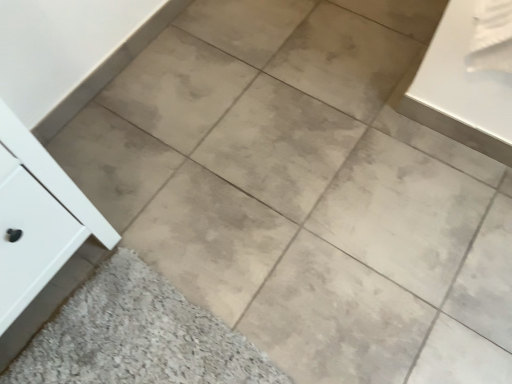
Question: Is white matte cabinet at left taller than beige matte tile at lower left?

Choices:
 (A) no
 (B) yes

Answer: (B)

Question: Is white matte cabinet at left facing towards beige matte tile at lower left?

Choices:
 (A) no
 (B) yes

Answer: (B)

Question: From a real-world perspective, is white matte cabinet at left on top of beige matte tile at lower left?

Choices:
 (A) no
 (B) yes

Answer: (B)

Question: Could beige matte tile at lower left be considered to be inside white matte cabinet at left?

Choices:
 (A) no
 (B) yes

Answer: (A)

Question: Does white matte cabinet at left appear on the right side of beige matte tile at lower left?

Choices:
 (A) yes
 (B) no

Answer: (B)

Question: Does white matte cabinet at left appear on the left side of beige matte tile at lower left?

Choices:
 (A) no
 (B) yes

Answer: (B)

Question: Is beige matte tile at lower left at the right side of white matte cabinet at left?

Choices:
 (A) yes
 (B) no

Answer: (A)

Question: Is beige matte tile at lower left to the left of white matte cabinet at left from the viewer's perspective?

Choices:
 (A) yes
 (B) no

Answer: (B)

Question: Are beige matte tile at lower left and white matte cabinet at left located far from each other?

Choices:
 (A) yes
 (B) no

Answer: (B)

Question: Is beige matte tile at lower left closer to the viewer compared to white matte cabinet at left?

Choices:
 (A) yes
 (B) no

Answer: (B)

Question: Does beige matte tile at lower left have a greater height compared to white matte cabinet at left?

Choices:
 (A) no
 (B) yes

Answer: (A)

Question: Considering the relative positions of beige matte tile at lower left and white matte cabinet at left in the image provided, is beige matte tile at lower left behind white matte cabinet at left?

Choices:
 (A) yes
 (B) no

Answer: (A)

Question: From a real-world perspective, is beige matte tile at lower left above or below white matte cabinet at left?

Choices:
 (A) below
 (B) above

Answer: (A)